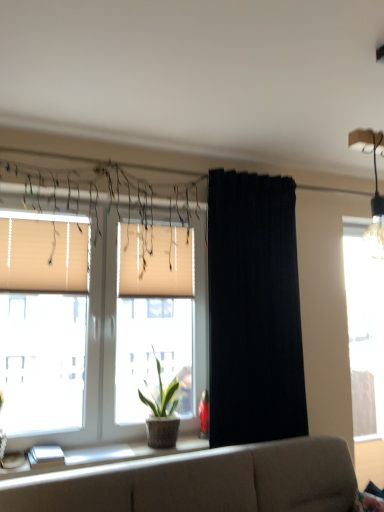
Question: From the image's perspective, relative to white glossy window sill at lower left, is black fabric curtain at center above or below?

Choices:
 (A) above
 (B) below

Answer: (A)

Question: Relative to white glossy window sill at lower left, is black fabric curtain at center in front or behind?

Choices:
 (A) front
 (B) behind

Answer: (B)

Question: Estimate the real-world distances between objects in this image. Which object is closer to the beige fabric window at center, the second window when ordered from right to left?

Choices:
 (A) beige fabric couch at lower center
 (B) white pleated blinds at center, acting as the second window blind starting from the front
 (C) beige fabric blinds at left, which is counted as the second window blind, starting from the right
 (D) green leafy plant in woven pot at window
 (E) transparent glass window at right, the first window positioned from the back

Answer: (C)

Question: Estimate the real-world distances between objects in this image. Which object is closer to the green leafy plant in woven pot at window?

Choices:
 (A) black fabric curtain at center
 (B) white pleated blinds at center, acting as the second window blind starting from the front
 (C) white glossy window sill at lower left
 (D) beige fabric blinds at left, the first window blind positioned from the front
 (E) beige fabric couch at lower center

Answer: (C)